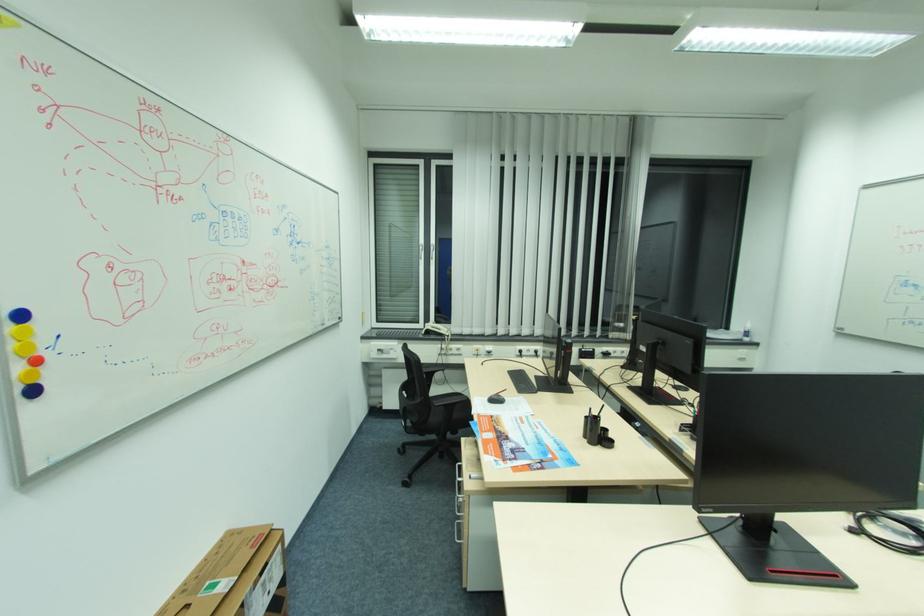
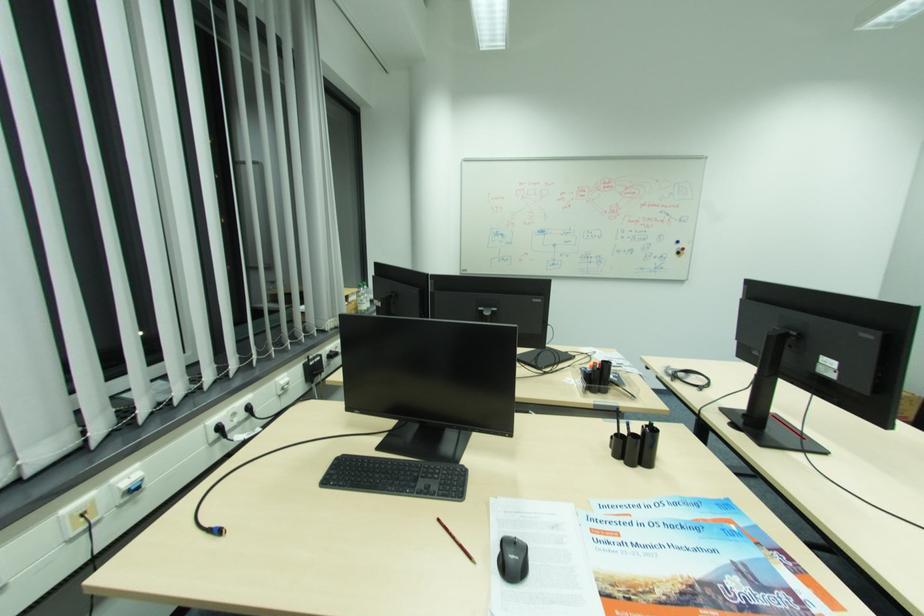
Find the pixel in the second image that matches point 585,350 in the first image.

(311, 365)